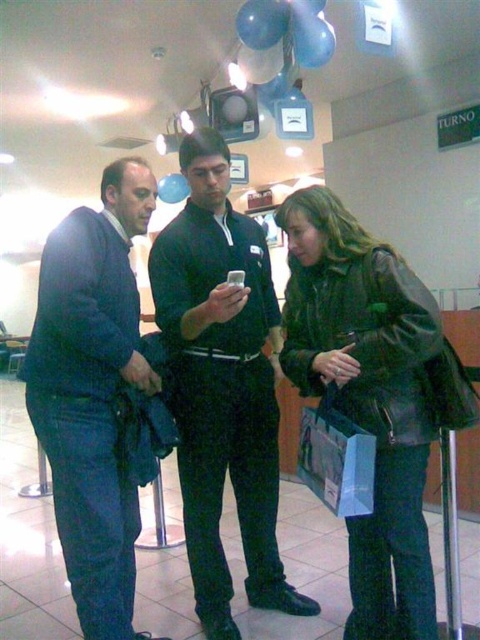
The width and height of the screenshot is (480, 640). What do you see at coordinates (223, 385) in the screenshot?
I see `black smooth shirt at center` at bounding box center [223, 385].

Who is more distant from viewer, (268, 456) or (300, 316)?

Positioned behind is point (268, 456).

Where is `black smooth shirt at center`? black smooth shirt at center is located at coordinates (223, 385).

Where is `black smooth shirt at center`? Image resolution: width=480 pixels, height=640 pixels. black smooth shirt at center is located at coordinates (223, 385).

Is black smooth shirt at center smaller than dark blue jeans at center?

No.

Does black smooth shirt at center have a greater height compared to dark blue jeans at center?

Yes.

Measure the distance between point (169, 346) and camera.

Point (169, 346) and camera are 2.04 meters apart from each other.

The image size is (480, 640). I want to click on black smooth shirt at center, so click(x=223, y=385).

Does leather jacket at lower right have a larger size compared to dark blue jeans at center?

Correct, leather jacket at lower right is larger in size than dark blue jeans at center.

Looking at this image, who is more distant from viewer, (412, 390) or (120, 227)?

Positioned behind is point (120, 227).

At what (x,y) coordinates should I click in order to perform the action: click on leather jacket at lower right. Please return your answer as a coordinate pair (x, y). The height and width of the screenshot is (640, 480). Looking at the image, I should click on (368, 396).